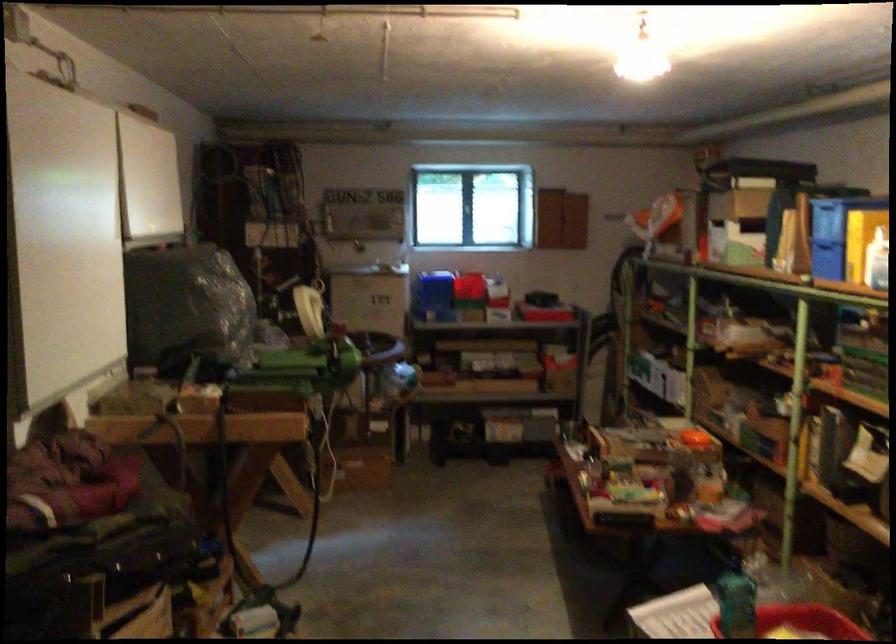
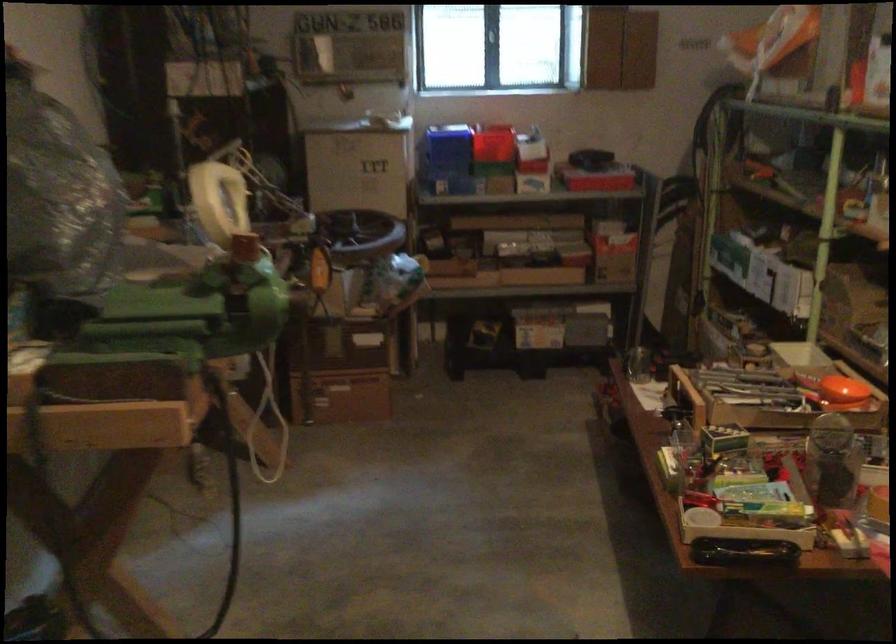
Question: In a continuous first-person perspective shot, in which direction is the camera moving?

Choices:
 (A) Left
 (B) Right
 (C) Forward
 (D) Backward

Answer: (C)